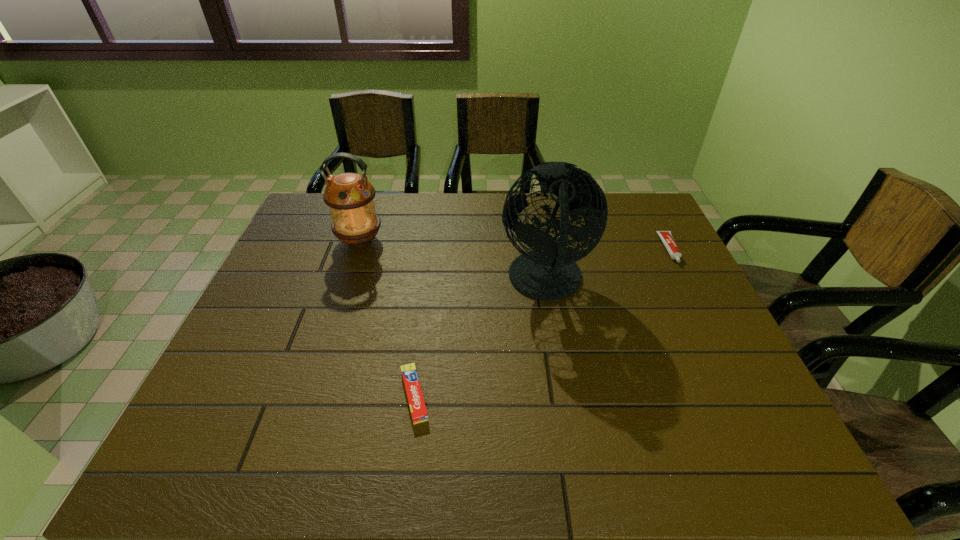
This screenshot has width=960, height=540. In the image, there is a desktop. Identify the location of free space at the left edge. (318, 239).

Where is `blank space at the right edge`? blank space at the right edge is located at coordinates (634, 253).

Where is `free space at the far left corner of the desktop`? This screenshot has height=540, width=960. free space at the far left corner of the desktop is located at coordinates (321, 196).

The width and height of the screenshot is (960, 540). In the image, there is a desktop. Identify the location of vacant space at the far right corner. (618, 225).

Where is `blank area at the near right corner`? The height and width of the screenshot is (540, 960). blank area at the near right corner is located at coordinates (744, 451).

Where is `free area in between the tallest object and the farther toothpaste`? The height and width of the screenshot is (540, 960). free area in between the tallest object and the farther toothpaste is located at coordinates (608, 266).

This screenshot has height=540, width=960. Find the location of `vacant area that lies between the nearer toothpaste and the rightmost object`. vacant area that lies between the nearer toothpaste and the rightmost object is located at coordinates click(542, 322).

This screenshot has width=960, height=540. What are the coordinates of `free point between the second tallest object and the globe` in the screenshot? It's located at (453, 261).

You are a GUI agent. You are given a task and a screenshot of the screen. Output one action in this format:
    pyautogui.click(x=<x>, y=<y>)
    Task: Click on the vacant space in between the tallest object and the third shortest object
    
    Given the screenshot: What is the action you would take?
    pyautogui.click(x=453, y=261)

You are a GUI agent. You are given a task and a screenshot of the screen. Output one action in this format:
    pyautogui.click(x=<x>, y=<y>)
    Task: Click on the free space between the globe and the taller toothpaste
    This screenshot has width=960, height=540.
    Given the screenshot: What is the action you would take?
    pyautogui.click(x=608, y=266)